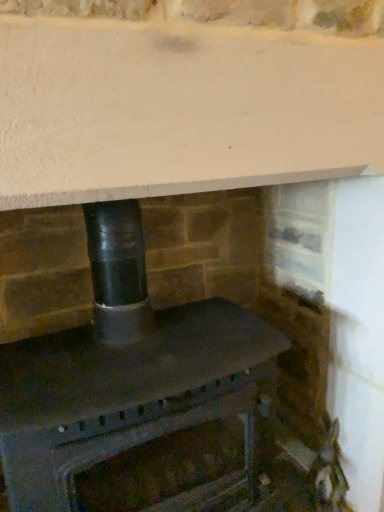
Identify the location of matte black wood burning stove at center. (123, 372).

The width and height of the screenshot is (384, 512). Describe the element at coordinates (123, 372) in the screenshot. I see `matte black wood burning stove at center` at that location.

Locate an element on the screen. The height and width of the screenshot is (512, 384). matte black wood burning stove at center is located at coordinates click(123, 372).